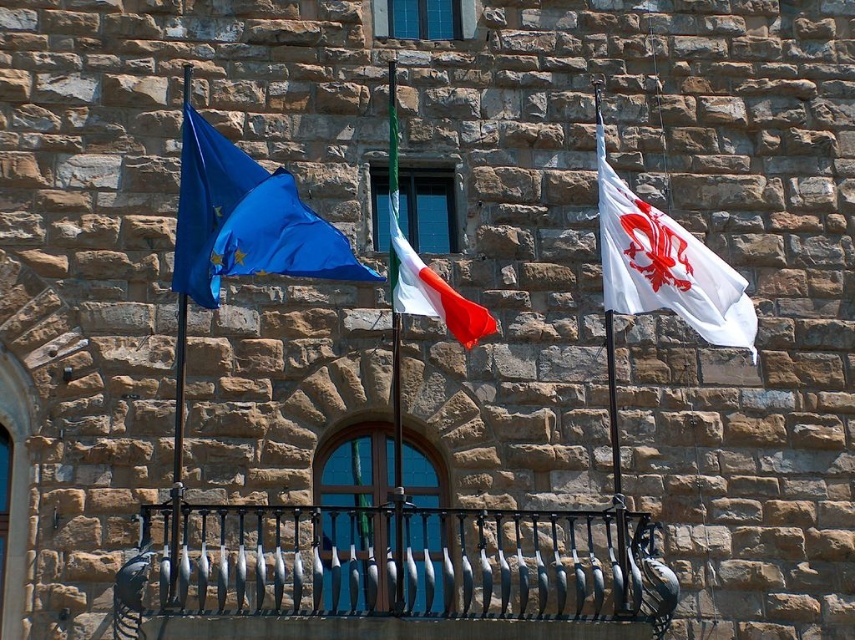
Question: Can you confirm if black wrought iron at center is bigger than blue fabric flag at upper left?

Choices:
 (A) yes
 (B) no

Answer: (A)

Question: Among these points, which one is farthest from the camera?

Choices:
 (A) (621, 282)
 (B) (516, 540)
 (C) (181, 208)
 (D) (397, 288)

Answer: (B)

Question: Which of these objects is positioned farthest from the white matte flag at right?

Choices:
 (A) black wrought iron at center
 (B) white fabric flag at center
 (C) blue fabric flag at upper left

Answer: (C)

Question: Is white matte flag at right wider than white fabric flag at center?

Choices:
 (A) yes
 (B) no

Answer: (A)

Question: Which point is farther to the camera?

Choices:
 (A) (172, 582)
 (B) (345, 264)

Answer: (B)

Question: Is black wrought iron at center further to the viewer compared to white matte flag at right?

Choices:
 (A) no
 (B) yes

Answer: (A)